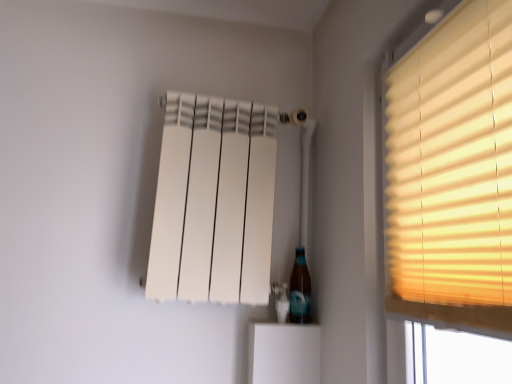
The width and height of the screenshot is (512, 384). Describe the element at coordinates (452, 174) in the screenshot. I see `matte yellow blinds at right` at that location.

Image resolution: width=512 pixels, height=384 pixels. What do you see at coordinates (300, 290) in the screenshot? I see `translucent glass bottle at lower right` at bounding box center [300, 290].

The height and width of the screenshot is (384, 512). What do you see at coordinates (214, 202) in the screenshot?
I see `white matte radiator at upper center` at bounding box center [214, 202].

Where is `matte yellow blinds at right`? This screenshot has height=384, width=512. matte yellow blinds at right is located at coordinates (452, 174).

Based on the photo, from a real-world perspective, which is physically above, translucent glass bottle at lower right or matte yellow blinds at right?

In real-world perspective, matte yellow blinds at right is above.

You are a GUI agent. You are given a task and a screenshot of the screen. Output one action in this format:
    pyautogui.click(x=<x>, y=<y>)
    Task: Click on the bottle directly beneath the matte yellow blinds at right (from a real-world perspective)
    
    Given the screenshot: What is the action you would take?
    [x=300, y=290]

In the scene shown: From the image's perspective, between translucent glass bottle at lower right and matte yellow blinds at right, which one is located above?

matte yellow blinds at right appears higher in the image.

How far apart are translucent glass bottle at lower right and matte yellow blinds at right?

translucent glass bottle at lower right is 23.45 inches from matte yellow blinds at right.

Based on the photo, from a real-world perspective, is translucent glass bottle at lower right positioned above or below white matte radiator at upper center?

translucent glass bottle at lower right is below white matte radiator at upper center.

At what (x,y) coordinates should I click in order to perform the action: click on bottle that appears below the white matte radiator at upper center (from a real-world perspective). Please return your answer as a coordinate pair (x, y). Looking at the image, I should click on pos(300,290).

What's the angular difference between translucent glass bottle at lower right and white matte radiator at upper center's facing directions?

The angular difference between translucent glass bottle at lower right and white matte radiator at upper center is 0.683 degrees.

Between translucent glass bottle at lower right and white matte radiator at upper center, which one has more height?

With more height is white matte radiator at upper center.

Consider the image. From the image's perspective, between matte yellow blinds at right and translucent glass bottle at lower right, which one is located above?

matte yellow blinds at right appears higher in the image.

Is matte yellow blinds at right placed right next to translucent glass bottle at lower right?

No.

Is the position of matte yellow blinds at right more distant than that of translucent glass bottle at lower right?

No, it is not.

Does matte yellow blinds at right have a greater width compared to translucent glass bottle at lower right?

No, matte yellow blinds at right is not wider than translucent glass bottle at lower right.

Is the position of white matte radiator at upper center more distant than that of translucent glass bottle at lower right?

No, white matte radiator at upper center is in front of translucent glass bottle at lower right.

Locate an element on the screen. bottle below the white matte radiator at upper center (from a real-world perspective) is located at coordinates (300, 290).

Can you tell me how much white matte radiator at upper center and translucent glass bottle at lower right differ in facing direction?

The angular difference between white matte radiator at upper center and translucent glass bottle at lower right is 0.683 degrees.

From a real-world perspective, does white matte radiator at upper center sit lower than translucent glass bottle at lower right?

No, from a real-world perspective, white matte radiator at upper center is not beneath translucent glass bottle at lower right.

Based on their positions, is white matte radiator at upper center located to the left or right of matte yellow blinds at right?

white matte radiator at upper center is to the left of matte yellow blinds at right.

From a real-world perspective, between white matte radiator at upper center and matte yellow blinds at right, who is vertically higher?

white matte radiator at upper center.

From the image's perspective, which one is positioned lower, white matte radiator at upper center or matte yellow blinds at right?

From the image's view, white matte radiator at upper center is below.

Based on the photo, is white matte radiator at upper center thinner than matte yellow blinds at right?

No.

Based on the photo, is matte yellow blinds at right wider or thinner than white matte radiator at upper center?

Clearly, matte yellow blinds at right has less width compared to white matte radiator at upper center.

From a real-world perspective, is matte yellow blinds at right physically above white matte radiator at upper center?

No, from a real-world perspective, matte yellow blinds at right is not above white matte radiator at upper center.

Is matte yellow blinds at right at the right side of white matte radiator at upper center?

Correct, you'll find matte yellow blinds at right to the right of white matte radiator at upper center.

You are a GUI agent. You are given a task and a screenshot of the screen. Output one action in this format:
    pyautogui.click(x=<x>, y=<y>)
    Task: Click on the window above the translucent glass bottle at lower right (from the image's perspective)
    
    Given the screenshot: What is the action you would take?
    (x=452, y=174)

You are a GUI agent. You are given a task and a screenshot of the screen. Output one action in this format:
    pyautogui.click(x=<x>, y=<y>)
    Task: Click on the curtain in front of the translucent glass bottle at lower right
    
    Given the screenshot: What is the action you would take?
    pyautogui.click(x=214, y=202)

Considering their positions, is white matte radiator at upper center positioned closer to matte yellow blinds at right than translucent glass bottle at lower right?

white matte radiator at upper center.

Looking at the image, which one is located further to white matte radiator at upper center, matte yellow blinds at right or translucent glass bottle at lower right?

Based on the image, matte yellow blinds at right appears to be further to white matte radiator at upper center.

Considering their positions, is translucent glass bottle at lower right positioned further to matte yellow blinds at right than white matte radiator at upper center?

The object further to matte yellow blinds at right is translucent glass bottle at lower right.

Considering their positions, is white matte radiator at upper center positioned closer to translucent glass bottle at lower right than matte yellow blinds at right?

Based on the image, white matte radiator at upper center appears to be nearer to translucent glass bottle at lower right.

Estimate the real-world distances between objects in this image. Which object is further from white matte radiator at upper center, translucent glass bottle at lower right or matte yellow blinds at right?

matte yellow blinds at right.

From the image, which object appears to be nearer to translucent glass bottle at lower right, matte yellow blinds at right or white matte radiator at upper center?

white matte radiator at upper center is closer to translucent glass bottle at lower right.

This screenshot has height=384, width=512. In order to click on curtain between matte yellow blinds at right and translucent glass bottle at lower right in the front-back direction in this screenshot , I will do `click(214, 202)`.